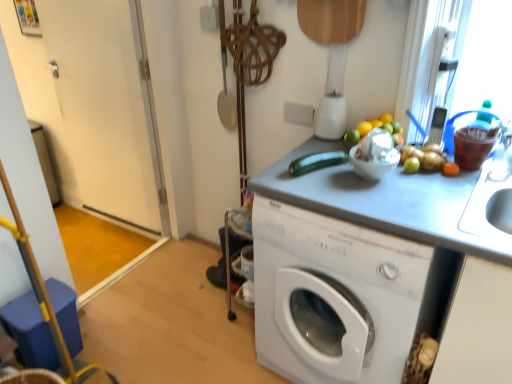
From a real-world perspective, find some spots in the free space above white glossy door at left. Your answer should be formatted as a list of tuples, i.e. [(x1, y1)], where each tuple contains the x and y coordinates of a point satisfying the conditions above.

[(0.173, -0.001)]